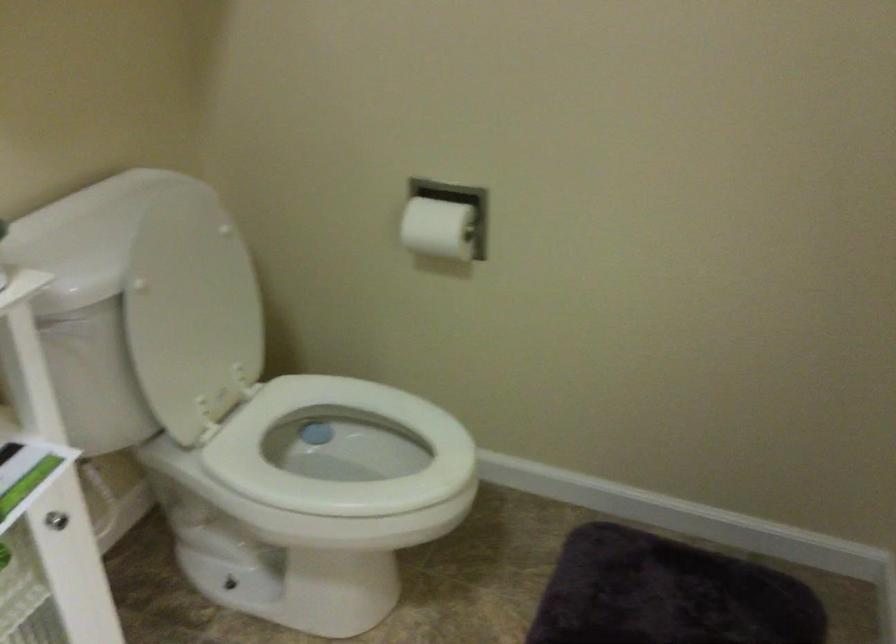
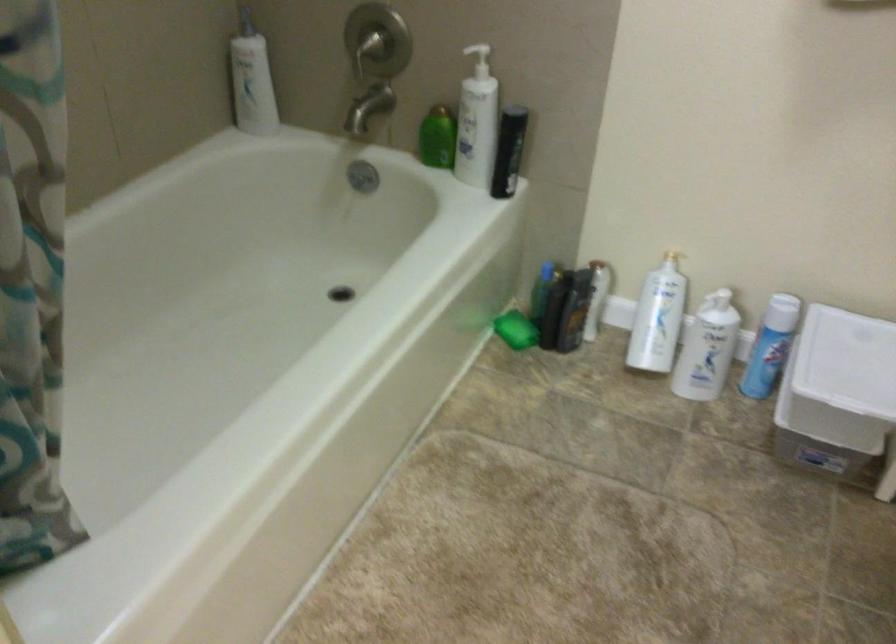
The first image is from the beginning of the video and the second image is from the end. How did the camera likely rotate when shooting the video?

The camera rotated toward left-down.